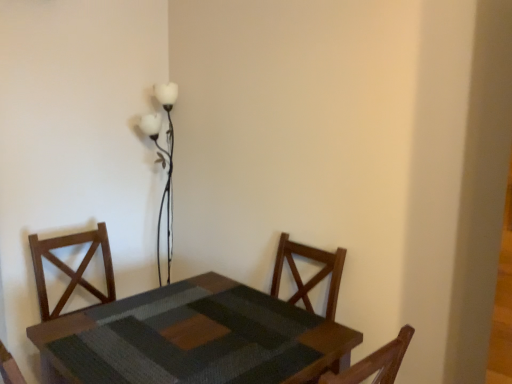
Question: Is wooden textured table at center bigger or smaller than white glass floor lamp at upper center?

Choices:
 (A) big
 (B) small

Answer: (A)

Question: Choose the correct answer: Is wooden textured table at center inside white glass floor lamp at upper center or outside it?

Choices:
 (A) inside
 (B) outside

Answer: (B)

Question: Relative to white glass floor lamp at upper center, is wooden textured table at center in front or behind?

Choices:
 (A) behind
 (B) front

Answer: (B)

Question: From the image's perspective, is white glass floor lamp at upper center above or below wooden textured table at center?

Choices:
 (A) above
 (B) below

Answer: (A)

Question: From a real-world perspective, relative to wooden textured table at center, is white glass floor lamp at upper center vertically above or below?

Choices:
 (A) above
 (B) below

Answer: (A)

Question: Relative to wooden textured table at center, is white glass floor lamp at upper center in front or behind?

Choices:
 (A) front
 (B) behind

Answer: (B)

Question: In terms of width, does white glass floor lamp at upper center look wider or thinner when compared to wooden textured table at center?

Choices:
 (A) wide
 (B) thin

Answer: (B)